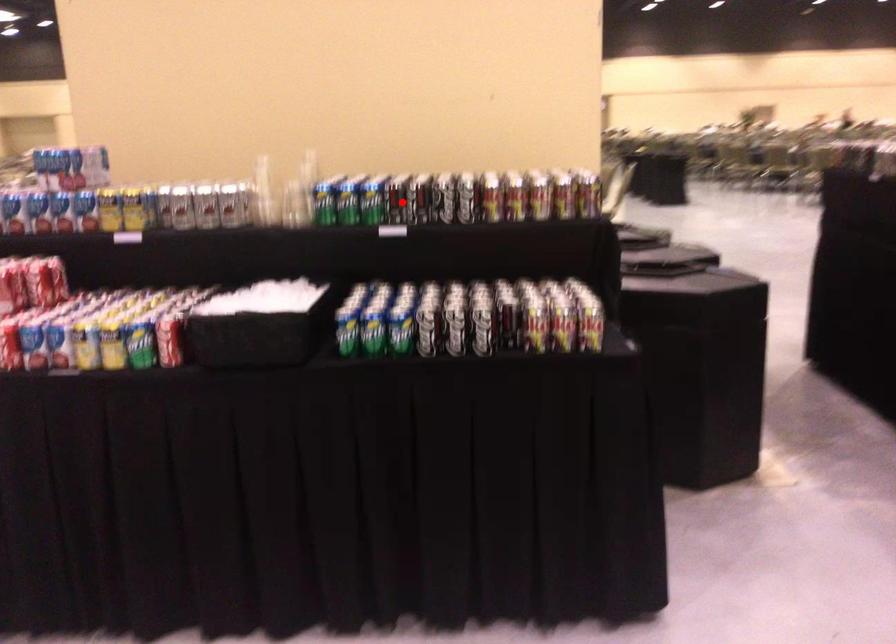
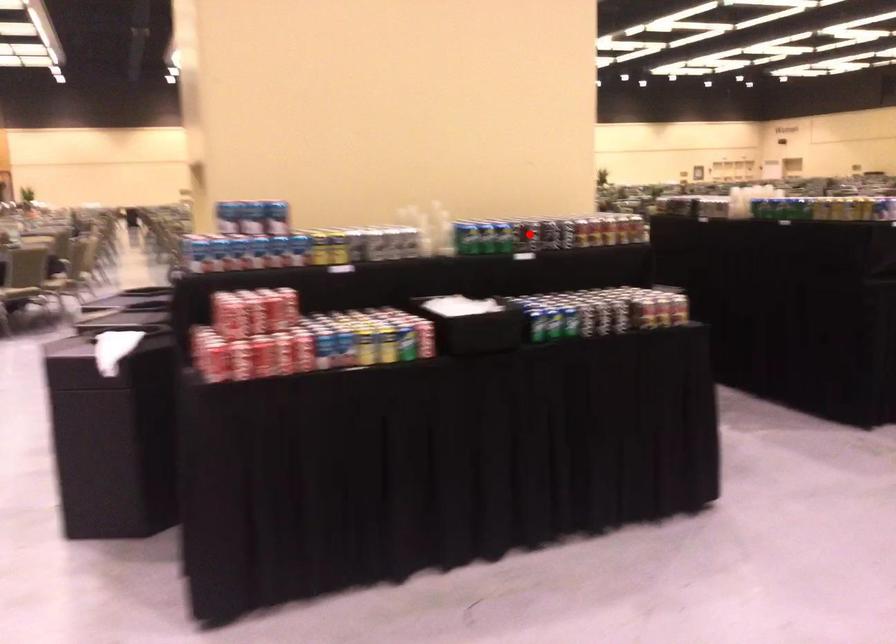
I am providing you with two images of the same scene from different viewpoints. A red point is marked on the first image and another point is marked on the second image. Is the red point in image1 aligned with the point shown in image2?

Yes